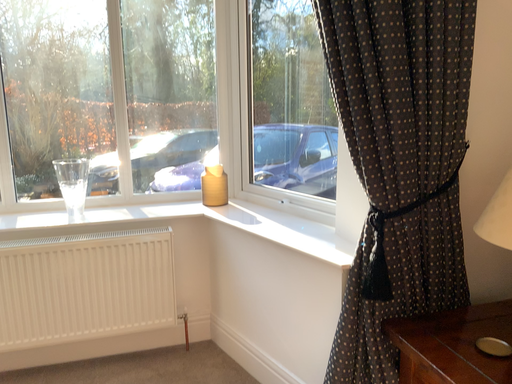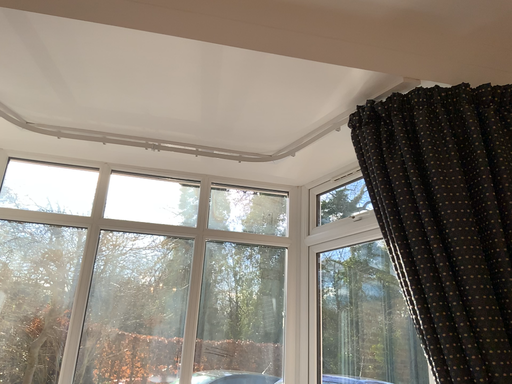
Question: Which way did the camera rotate in the video?

Choices:
 (A) rotated upward
 (B) rotated downward

Answer: (A)